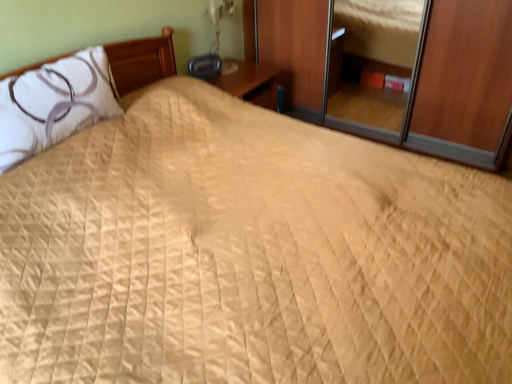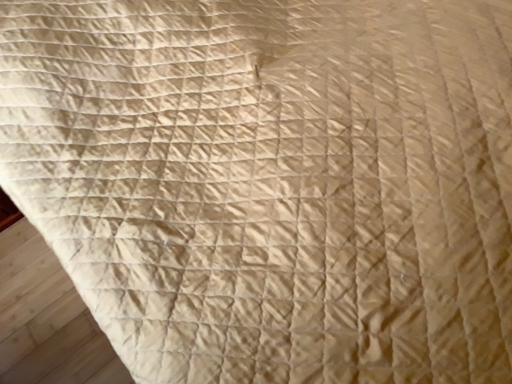
Question: How did the camera likely rotate when shooting the video?

Choices:
 (A) rotated downward
 (B) rotated upward

Answer: (A)